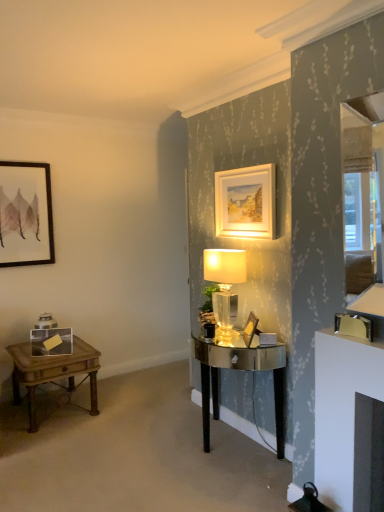
Question: Does matte black picture frame at upper left, which is counted as the 2th picture frame, starting from the bottom, have a greater width compared to translucent glass lamp at center?

Choices:
 (A) yes
 (B) no

Answer: (B)

Question: Would you say matte black picture frame at upper left, the 1th picture frame viewed from the back, is outside translucent glass lamp at center?

Choices:
 (A) no
 (B) yes

Answer: (B)

Question: Considering the relative sizes of matte black picture frame at upper left, the 1th picture frame viewed from the back, and translucent glass lamp at center in the image provided, is matte black picture frame at upper left, the 1th picture frame viewed from the back, taller than translucent glass lamp at center?

Choices:
 (A) yes
 (B) no

Answer: (A)

Question: Can you confirm if matte black picture frame at upper left, which ranks as the first picture frame in left-to-right order, is bigger than translucent glass lamp at center?

Choices:
 (A) yes
 (B) no

Answer: (B)

Question: Is matte black picture frame at upper left, arranged as the 3th picture frame when viewed from the right, oriented away from translucent glass lamp at center?

Choices:
 (A) no
 (B) yes

Answer: (A)

Question: From the image's perspective, is matte black picture frame at upper left, the 1th picture frame viewed from the back, located above or below wooden picture frame at center, which is the third picture frame from back to front?

Choices:
 (A) below
 (B) above

Answer: (B)

Question: In the image, is matte black picture frame at upper left, positioned as the second picture frame in top-to-bottom order, positioned in front of or behind wooden picture frame at center, which appears as the third picture frame when viewed from the top?

Choices:
 (A) front
 (B) behind

Answer: (B)

Question: In terms of height, does matte black picture frame at upper left, which ranks as the first picture frame in left-to-right order, look taller or shorter compared to wooden picture frame at center, which is the 1th picture frame in front-to-back order?

Choices:
 (A) tall
 (B) short

Answer: (A)

Question: Is matte black picture frame at upper left, arranged as the 3th picture frame when viewed from the right, wider or thinner than wooden picture frame at center, acting as the 3th picture frame starting from the left?

Choices:
 (A) thin
 (B) wide

Answer: (A)

Question: From the image's perspective, relative to translucent glass lamp at center, is wooden side table at left above or below?

Choices:
 (A) above
 (B) below

Answer: (B)

Question: Is wooden side table at left taller or shorter than translucent glass lamp at center?

Choices:
 (A) short
 (B) tall

Answer: (A)

Question: From a real-world perspective, relative to translucent glass lamp at center, is wooden side table at left vertically above or below?

Choices:
 (A) below
 (B) above

Answer: (A)

Question: Is wooden side table at left bigger or smaller than translucent glass lamp at center?

Choices:
 (A) small
 (B) big

Answer: (B)

Question: Is translucent glass lamp at center inside or outside of matte black picture frame at upper left, which ranks as the first picture frame in left-to-right order?

Choices:
 (A) inside
 (B) outside

Answer: (B)

Question: Considering the positions of translucent glass lamp at center and matte black picture frame at upper left, positioned as the second picture frame in top-to-bottom order, in the image, is translucent glass lamp at center taller or shorter than matte black picture frame at upper left, positioned as the second picture frame in top-to-bottom order,?

Choices:
 (A) short
 (B) tall

Answer: (A)